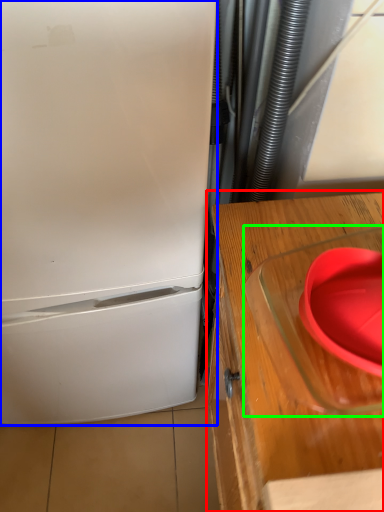
Question: Based on their relative distances, which object is farther from table (highlighted by a red box)? Choose from refrigerator (highlighted by a blue box) and appliance (highlighted by a green box).

Choices:
 (A) refrigerator
 (B) appliance

Answer: (A)